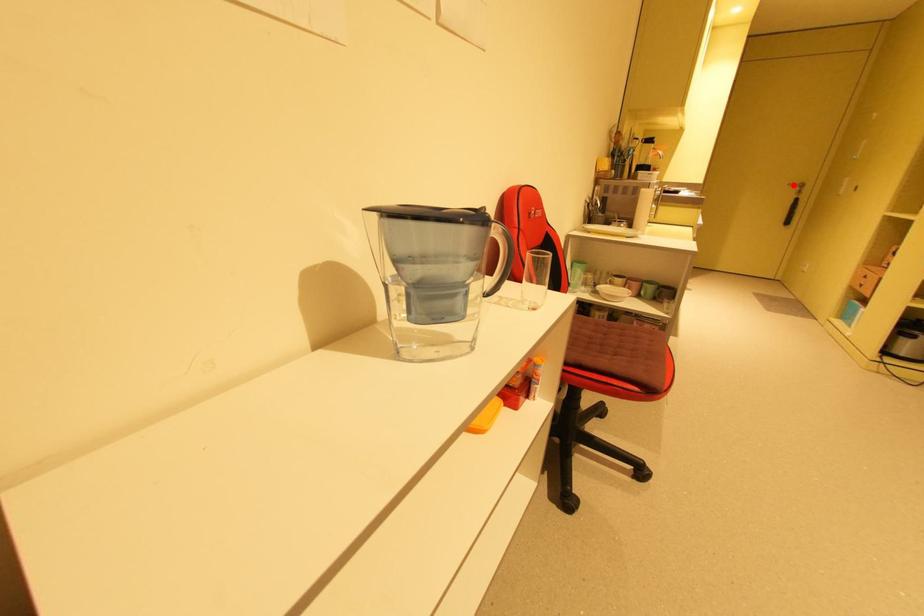
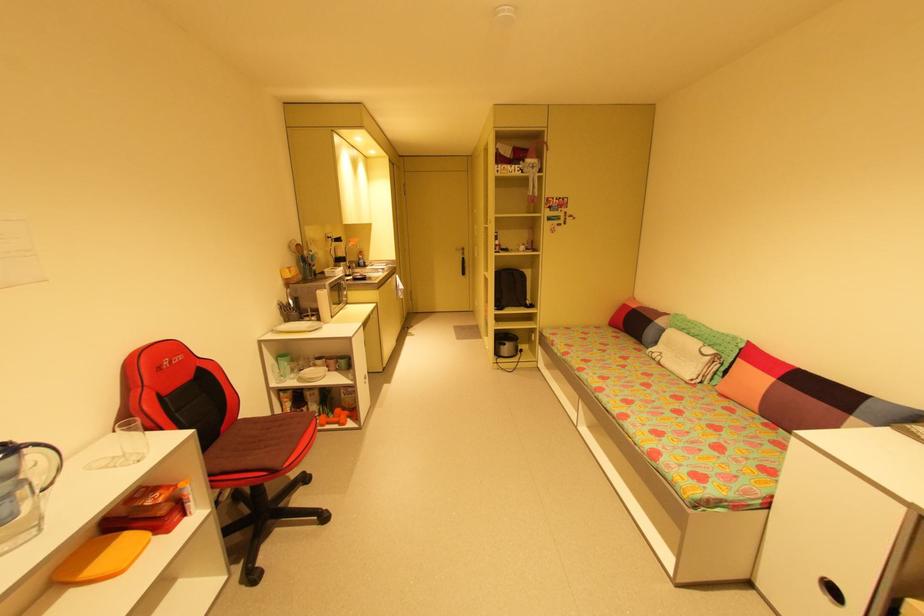
Question: I am providing you with two images of the same scene from different viewpoints. Given a red point in image1, look at the same physical point in image2. Is it:

Choices:
 (A) Closer to the viewpoint
 (B) Farther from the viewpoint

Answer: (A)